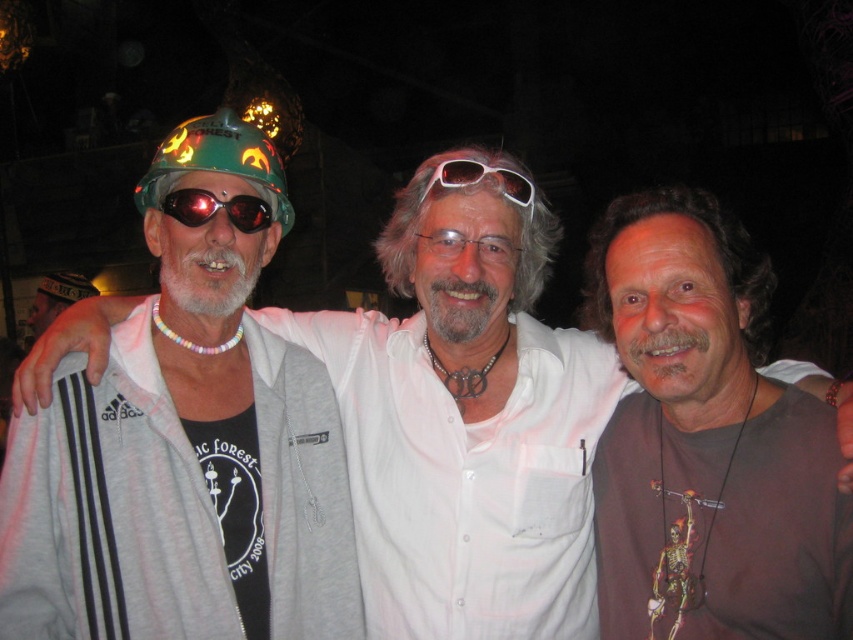
Question: Which of the following is the closest to the observer?

Choices:
 (A) white leather hat at left
 (B) brown matte t-shirt at center
 (C) matte black goggles at center
 (D) white plastic sunglasses at center

Answer: (B)

Question: Can you confirm if matte green helmet at left is positioned to the left of brown matte t-shirt at center?

Choices:
 (A) no
 (B) yes

Answer: (B)

Question: Among these objects, which one is nearest to the camera?

Choices:
 (A) matte black goggles at center
 (B) white plastic sunglasses at center
 (C) matte green helmet at left

Answer: (C)

Question: Is matte green helmet at left below brown matte t-shirt at center?

Choices:
 (A) yes
 (B) no

Answer: (B)

Question: Does brown matte t-shirt at center appear on the right side of matte black goggles at center?

Choices:
 (A) no
 (B) yes

Answer: (B)

Question: Which point is farther to the camera?

Choices:
 (A) (509, 184)
 (B) (201, 202)
 (C) (93, 285)

Answer: (C)